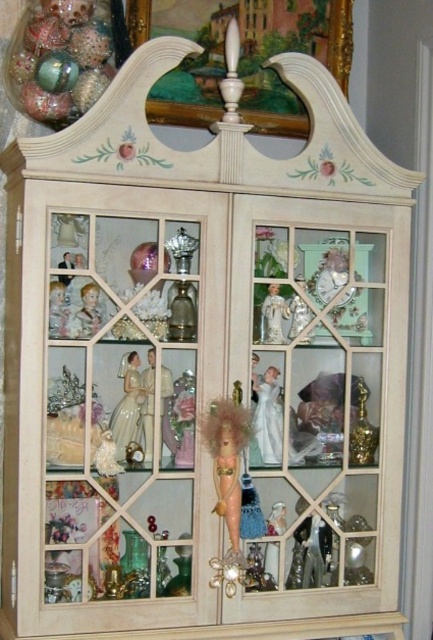
Question: Is the position of white porcelain doll at center more distant than that of porcelain doll at center?

Choices:
 (A) yes
 (B) no

Answer: (A)

Question: Which of the following is the closest to the observer?

Choices:
 (A) coord(129,429)
 (B) coord(232,538)

Answer: (B)

Question: Can you confirm if shiny gold doll at center is positioned below porcelain doll at center?

Choices:
 (A) no
 (B) yes

Answer: (B)

Question: Which object is closer to the camera taking this photo?

Choices:
 (A) shiny gold doll at center
 (B) white porcelain doll at center

Answer: (A)

Question: Which object is positioned closest to the porcelain doll at center?

Choices:
 (A) shiny gold doll at center
 (B) white porcelain doll at center

Answer: (A)

Question: Does shiny gold doll at center have a smaller size compared to porcelain doll at center?

Choices:
 (A) no
 (B) yes

Answer: (B)